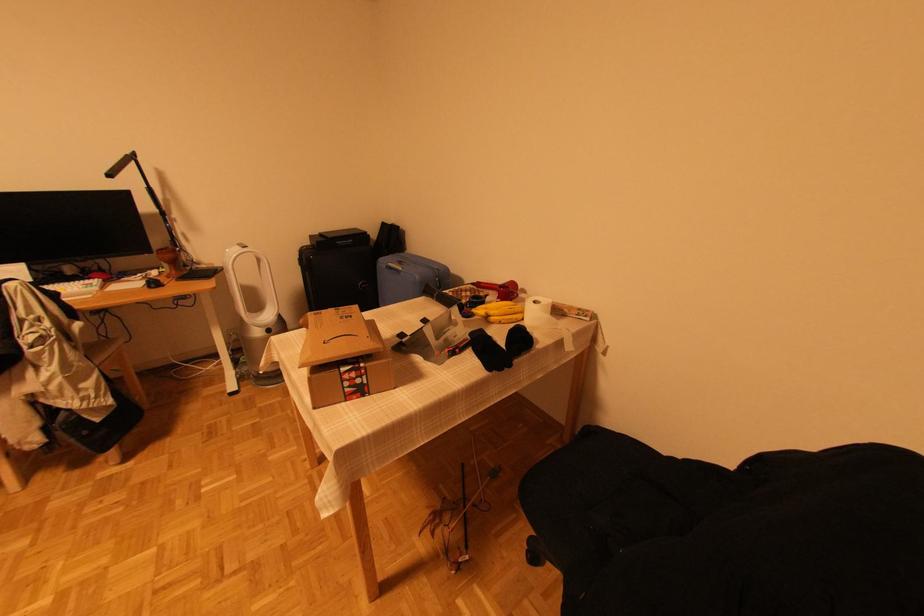
You are a GUI agent. You are given a task and a screenshot of the screen. Output one action in this format:
    pyautogui.click(x=<x>, y=<y>)
    Task: Click on the black speaker handle
    
    Given the screenshot: What is the action you would take?
    pyautogui.click(x=338, y=270)